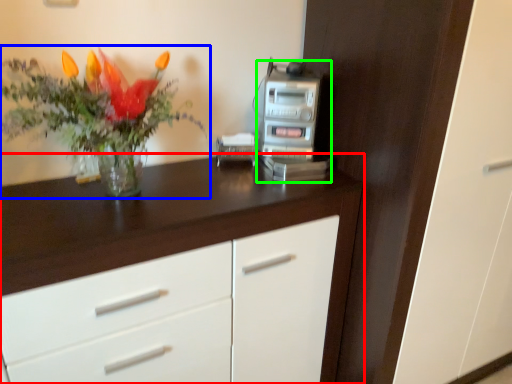
Question: Considering the real-world distances, which object is closest to chest of drawers (highlighted by a red box)? houseplant (highlighted by a blue box) or appliance (highlighted by a green box).

Choices:
 (A) houseplant
 (B) appliance

Answer: (A)